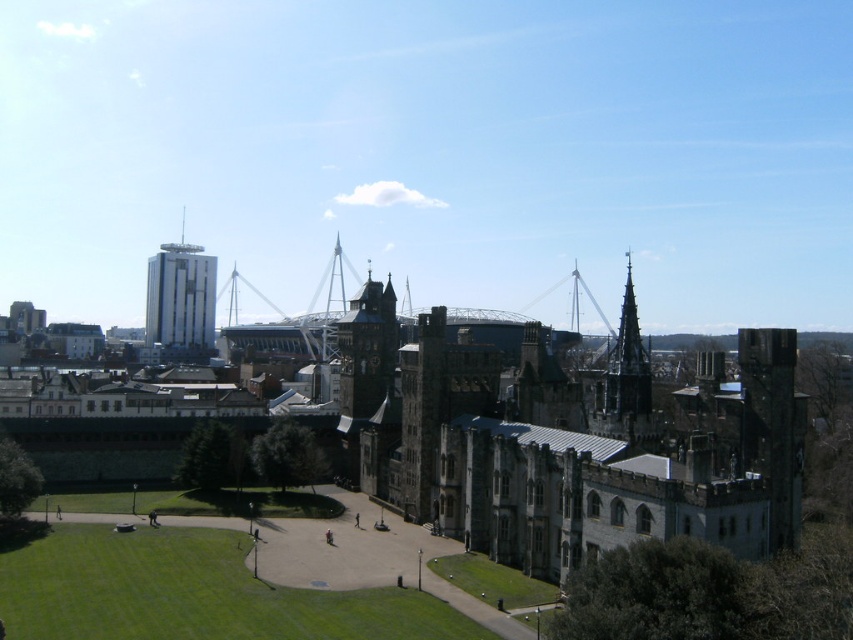
Does dark gray stone spire at upper right have a greater width compared to shiny silver spire at center?

In fact, dark gray stone spire at upper right might be narrower than shiny silver spire at center.

Between dark gray stone spire at upper right and shiny silver spire at center, which one appears on the left side from the viewer's perspective?

From the viewer's perspective, shiny silver spire at center appears more on the left side.

Does point (625, 272) lie in front of point (328, 276)?

That is True.

The height and width of the screenshot is (640, 853). In order to click on dark gray stone spire at upper right in this screenshot , I will do `click(627, 365)`.

Can you confirm if gray stone castle at center is positioned above dark gray stone spire at upper right?

No, gray stone castle at center is not above dark gray stone spire at upper right.

This screenshot has height=640, width=853. What do you see at coordinates (570, 442) in the screenshot?
I see `gray stone castle at center` at bounding box center [570, 442].

Image resolution: width=853 pixels, height=640 pixels. Find the location of `gray stone castle at center`. gray stone castle at center is located at coordinates (570, 442).

Can you confirm if white smooth tower at upper left is positioned above dark gray stone spire at upper right?

Indeed, white smooth tower at upper left is positioned over dark gray stone spire at upper right.

Which is more to the right, white smooth tower at upper left or dark gray stone spire at upper right?

Positioned to the right is dark gray stone spire at upper right.

The width and height of the screenshot is (853, 640). I want to click on white smooth tower at upper left, so coord(180,300).